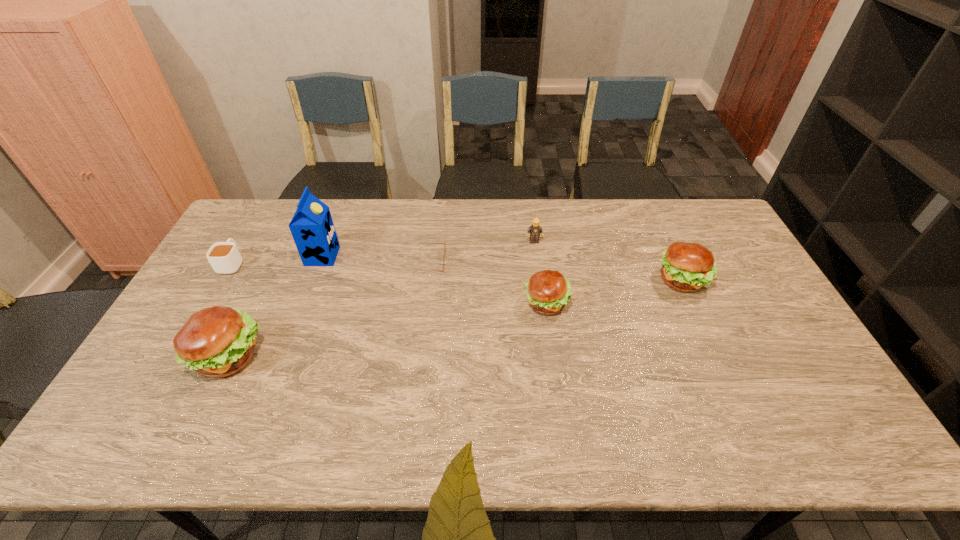
Where is `vacant point located in front of the Lego`? vacant point located in front of the Lego is located at coordinates (540, 290).

What are the coordinates of `object present at the far edge` in the screenshot? It's located at pyautogui.click(x=534, y=230).

At what (x,y) coordinates should I click in order to perform the action: click on object present at the near edge. Please return your answer as a coordinate pair (x, y). Looking at the image, I should click on (218, 341).

Where is `hamburger that is at the left edge`? The height and width of the screenshot is (540, 960). hamburger that is at the left edge is located at coordinates (218, 341).

Where is `cup located in the left edge section of the desktop`? Image resolution: width=960 pixels, height=540 pixels. cup located in the left edge section of the desktop is located at coordinates (224, 257).

Image resolution: width=960 pixels, height=540 pixels. I want to click on object located at the right edge, so click(x=687, y=267).

This screenshot has height=540, width=960. What are the coordinates of `object located in the near left corner section of the desktop` in the screenshot? It's located at (218, 341).

In the image, there is a desktop. What are the coordinates of `free space at the far edge` in the screenshot? It's located at (582, 229).

What are the coordinates of `vacant area at the near edge` in the screenshot? It's located at (319, 384).

This screenshot has height=540, width=960. I want to click on free space at the left edge, so click(228, 284).